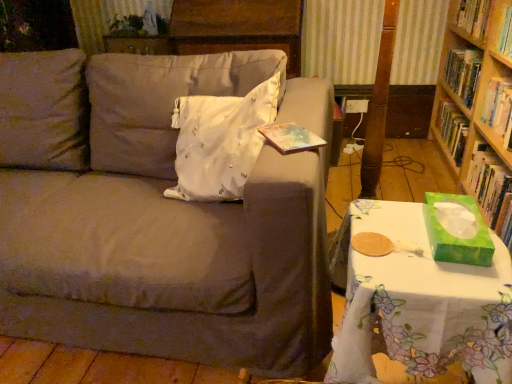
Question: From the image's perspective, does hardcover book at upper right, which is counted as the 1th book, starting from the top, appear higher than white floral tablecloth at lower right?

Choices:
 (A) no
 (B) yes

Answer: (B)

Question: From a real-world perspective, is hardcover book at upper right, which is the 3th book in bottom-to-top order, positioned over white floral tablecloth at lower right based on gravity?

Choices:
 (A) yes
 (B) no

Answer: (A)

Question: Is hardcover book at upper right, which is the 3th book in bottom-to-top order, facing away from white floral tablecloth at lower right?

Choices:
 (A) yes
 (B) no

Answer: (B)

Question: Is hardcover book at upper right, which is counted as the 1th book, starting from the top, completely or partially outside of white floral tablecloth at lower right?

Choices:
 (A) no
 (B) yes

Answer: (B)

Question: Considering the relative positions of hardcover book at upper right, which is counted as the 1th book, starting from the top, and white floral tablecloth at lower right in the image provided, is hardcover book at upper right, which is counted as the 1th book, starting from the top, to the left of white floral tablecloth at lower right from the viewer's perspective?

Choices:
 (A) yes
 (B) no

Answer: (B)

Question: Can you confirm if hardcover book at upper right, which is the 3th book in bottom-to-top order, is positioned to the right of white floral tablecloth at lower right?

Choices:
 (A) no
 (B) yes

Answer: (B)

Question: Is matte gray couch at center far away from green matte tissue box at right, placed as the first book when sorted from bottom to top?

Choices:
 (A) yes
 (B) no

Answer: (A)

Question: Is matte gray couch at center closer to the viewer compared to green matte tissue box at right, which is the third book in top-to-bottom order?

Choices:
 (A) yes
 (B) no

Answer: (A)

Question: Does matte gray couch at center have a greater height compared to green matte tissue box at right, placed as the first book when sorted from bottom to top?

Choices:
 (A) yes
 (B) no

Answer: (A)

Question: Considering the relative sizes of matte gray couch at center and green matte tissue box at right, placed as the first book when sorted from bottom to top, in the image provided, is matte gray couch at center shorter than green matte tissue box at right, placed as the first book when sorted from bottom to top,?

Choices:
 (A) yes
 (B) no

Answer: (B)

Question: Is matte gray couch at center not within green matte tissue box at right, which is the third book in top-to-bottom order?

Choices:
 (A) yes
 (B) no

Answer: (A)

Question: Is matte gray couch at center turned away from green matte tissue box at right, placed as the first book when sorted from bottom to top?

Choices:
 (A) no
 (B) yes

Answer: (A)

Question: Does white floral tablecloth at lower right appear on the left side of green matte tissue box at right, which is the third book in top-to-bottom order?

Choices:
 (A) no
 (B) yes

Answer: (B)